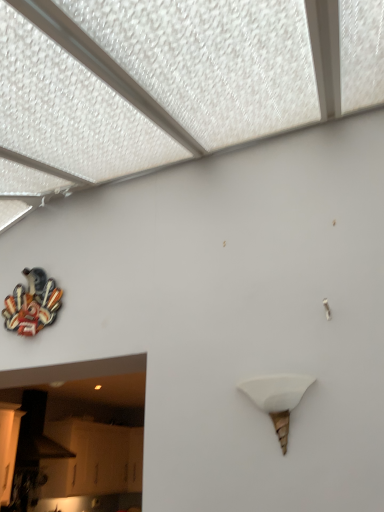
Question: Is white matte cone at center-right surrounded by metallic/multicolored sculpture at upper left?

Choices:
 (A) no
 (B) yes

Answer: (A)

Question: From a real-world perspective, is metallic/multicolored sculpture at upper left on top of white matte cone at center-right?

Choices:
 (A) no
 (B) yes

Answer: (B)

Question: Is metallic/multicolored sculpture at upper left facing away from white matte cone at center-right?

Choices:
 (A) yes
 (B) no

Answer: (B)

Question: Is metallic/multicolored sculpture at upper left facing towards white matte cone at center-right?

Choices:
 (A) yes
 (B) no

Answer: (B)

Question: Does metallic/multicolored sculpture at upper left have a larger size compared to white matte cone at center-right?

Choices:
 (A) no
 (B) yes

Answer: (B)

Question: Does metallic/multicolored sculpture at upper left lie behind white matte cone at center-right?

Choices:
 (A) yes
 (B) no

Answer: (A)

Question: From a real-world perspective, is white matte cone at center-right located beneath metallic/multicolored sculpture at upper left?

Choices:
 (A) no
 (B) yes

Answer: (B)

Question: Can you confirm if white matte cone at center-right is taller than metallic/multicolored sculpture at upper left?

Choices:
 (A) yes
 (B) no

Answer: (B)

Question: Considering the relative positions of white matte cone at center-right and metallic/multicolored sculpture at upper left in the image provided, is white matte cone at center-right to the right of metallic/multicolored sculpture at upper left from the viewer's perspective?

Choices:
 (A) yes
 (B) no

Answer: (A)

Question: Does white matte cone at center-right have a larger size compared to metallic/multicolored sculpture at upper left?

Choices:
 (A) no
 (B) yes

Answer: (A)

Question: Does white matte cone at center-right have a lesser height compared to metallic/multicolored sculpture at upper left?

Choices:
 (A) yes
 (B) no

Answer: (A)

Question: Is metallic/multicolored sculpture at upper left located within white matte cone at center-right?

Choices:
 (A) no
 (B) yes

Answer: (A)

Question: Is metallic/multicolored sculpture at upper left in front of or behind white matte cone at center-right in the image?

Choices:
 (A) behind
 (B) front

Answer: (A)